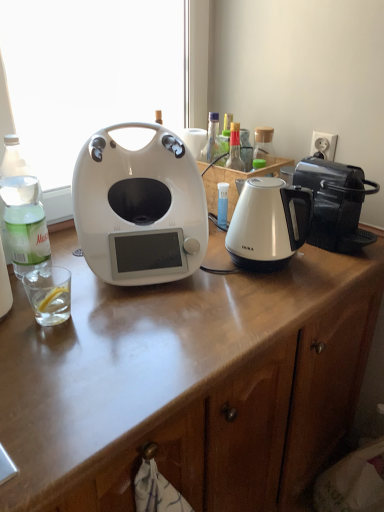
Question: In terms of width, does white glossy coffee maker at center look wider or thinner when compared to white glossy kettle at center-right?

Choices:
 (A) wide
 (B) thin

Answer: (A)

Question: Based on their positions, is white glossy coffee maker at center located to the left or right of white glossy kettle at center-right?

Choices:
 (A) left
 (B) right

Answer: (A)

Question: Which is farther from the black plastic toaster at right?

Choices:
 (A) white plastic power outlet at upper right
 (B) white glossy kettle at center-right
 (C) white glossy coffee maker at center
 (D) clear glass at left
 (E) clear glass bottle at left

Answer: (E)

Question: Which is farther from the clear glass bottle at left?

Choices:
 (A) white glossy coffee maker at center
 (B) black plastic toaster at right
 (C) white glossy kettle at center-right
 (D) clear glass at left
 (E) white plastic power outlet at upper right

Answer: (E)